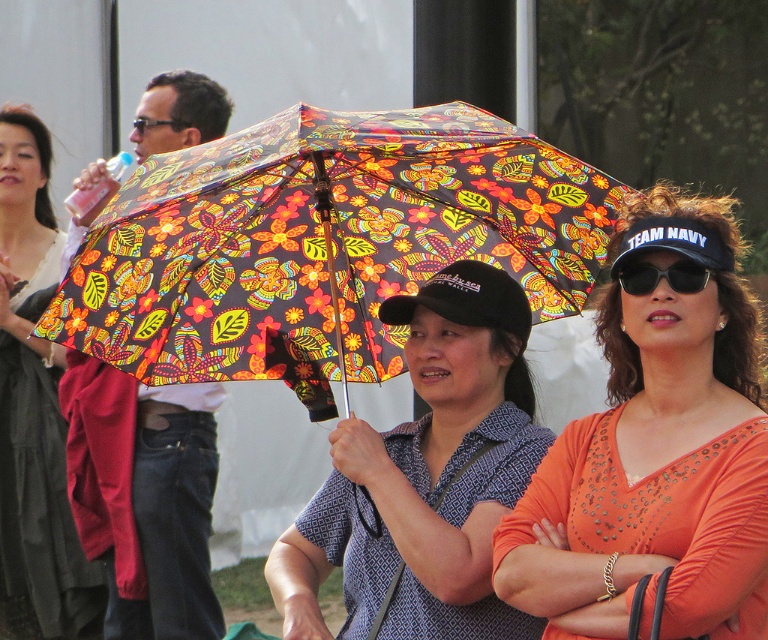
Question: Based on their relative distances, which object is farther from the floral-patterned fabric umbrella at center?

Choices:
 (A) matte black umbrella at upper center
 (B) black plastic sunglasses at upper right
 (C) floral-patterned umbrella at center

Answer: (A)

Question: Which of the following is the closest to the observer?

Choices:
 (A) (98, 600)
 (B) (541, 464)

Answer: (B)

Question: Is orange jersey at center positioned in front of black plastic sunglasses at upper right?

Choices:
 (A) no
 (B) yes

Answer: (B)

Question: From the image, what is the correct spatial relationship of floral-patterned fabric umbrella at center in relation to black plastic sunglasses at upper right?

Choices:
 (A) left
 (B) right

Answer: (A)

Question: Is floral-patterned umbrella at center thinner than matte floral umbrella at left?

Choices:
 (A) no
 (B) yes

Answer: (A)

Question: Among these points, which one is farthest from the camera?

Choices:
 (A) (88, 612)
 (B) (621, 275)
 (C) (581, 589)

Answer: (A)